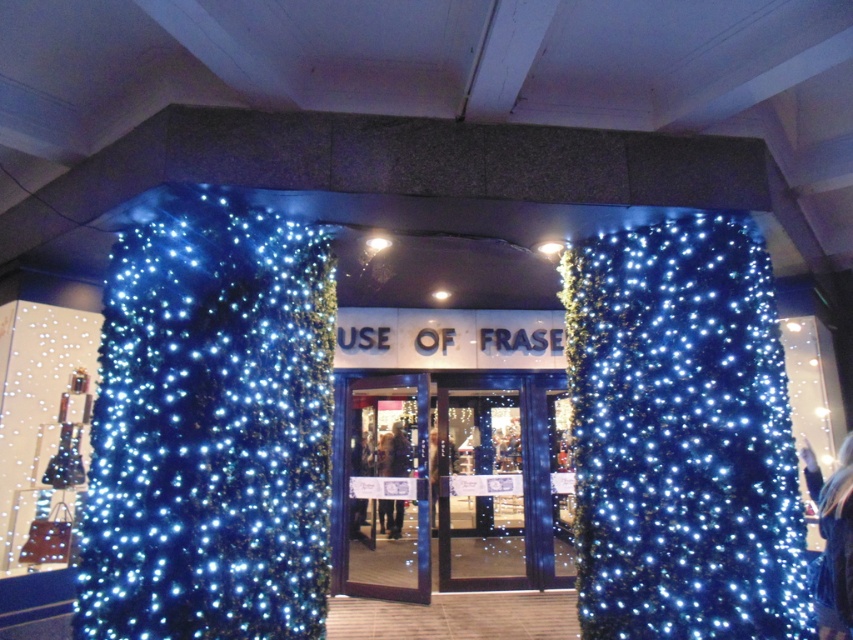
You are a delivery person trying to enter the store through the entrance. You see the blue glass doors at center and the shiny dark blue door at center. Which door should you push to enter?

The blue glass doors at center is positioned over the shiny dark blue door at center, so you should push the blue glass doors at center to enter.

You are a customer approaching the entrance of the store. You see the illuminated blue lights at center and the transparent glass door at center. Which object is positioned to the right side from your perspective?

The illuminated blue lights at center are positioned to the right of the transparent glass door at center.